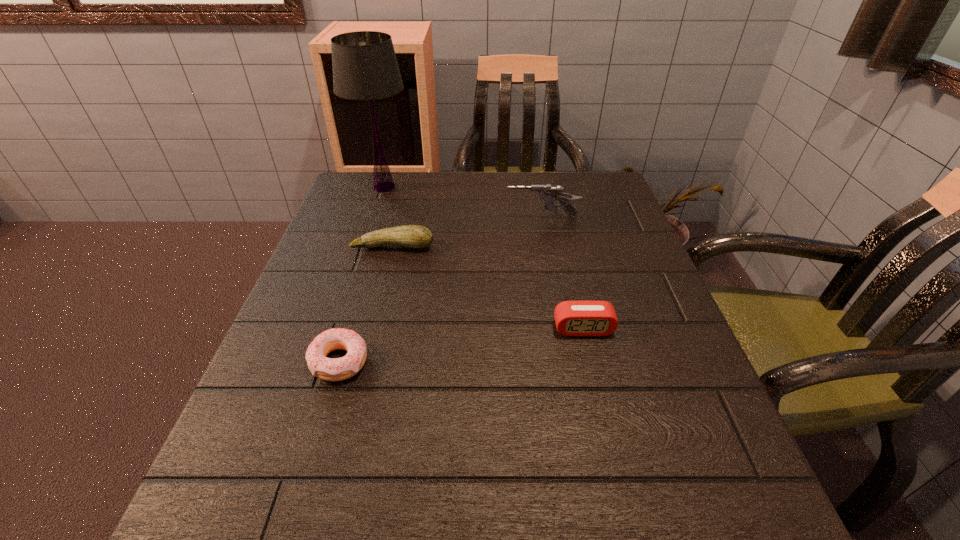
Identify which object is located as the third nearest to the nearest object. Please provide its 2D coordinates. Your answer should be formatted as a tuple, i.e. [(x, y)], where the tuple contains the x and y coordinates of a point satisfying the conditions above.

[(548, 193)]

The image size is (960, 540). What are the coordinates of `free spot that satisfies the following two spatial constraints: 1. at the barrel of the fourth shortest object; 2. at the stem end of the zucchini` in the screenshot? It's located at (547, 246).